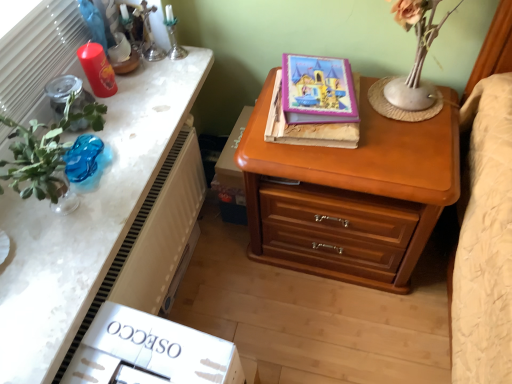
Locate an element on the screen. Image resolution: width=512 pixels, height=384 pixels. free spot in front of hardcover book at center, which is the 1th book from bottom to top is located at coordinates (349, 165).